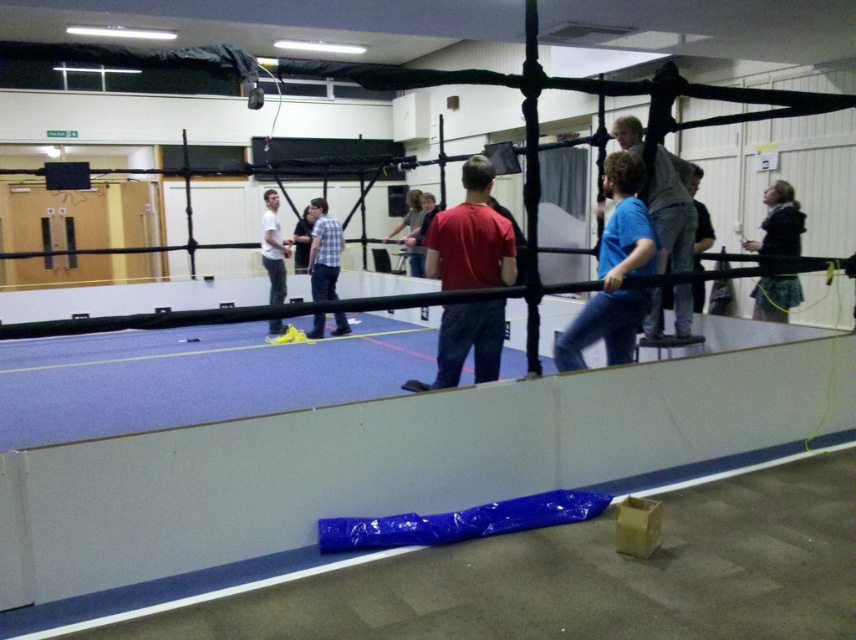
You are standing at the entrance of the gymnasium and want to locate the person wearing the red matte shirt at center. According to the coordinates provided, where should you look to find them?

The person wearing the red matte shirt at center is located at the coordinates point (471, 236), which is the center area of the gymnasium.

You are observing a wrestling training session in a gymnasium. You notice two people wearing specific clothing items. The first is a blue matte shirt at upper center, and the second is a dark blue textured skirt at right. Based on their positions, which clothing item is closer to the left side of the scene?

The blue matte shirt at upper center is closer to the left side of the scene because it is positioned to the left of the dark blue textured skirt at right.

You are standing at the edge of the wrestling platform and want to hand a water bottle to the person in the blue matte shirt at upper center. The water bottle is 0.3 meters in length. Can you reach them without stepping onto the platform?

The blue matte shirt at upper center is 4.11 meters away from you. Since the water bottle is only 0.3 meters long, you cannot reach them without stepping onto the platform.